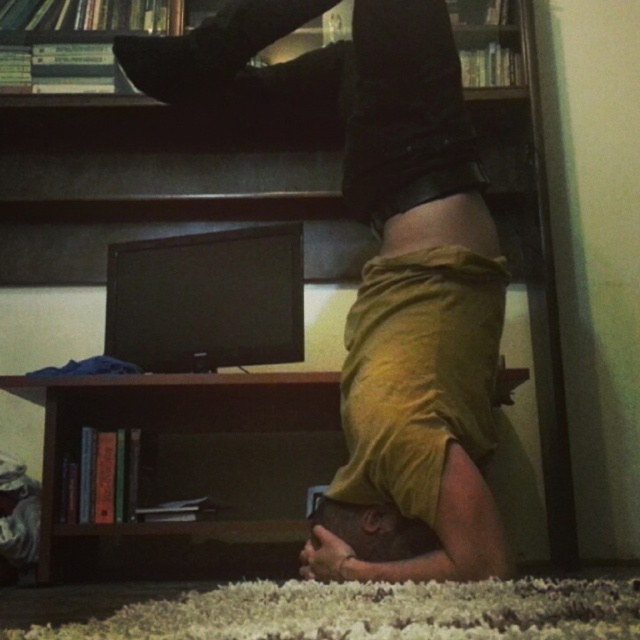
Question: Is brown wood bookshelf at lower center positioned behind matte black monitor at center?

Choices:
 (A) no
 (B) yes

Answer: (A)

Question: Which point is closer to the camera taking this photo?

Choices:
 (A) (109, 333)
 (B) (371, 531)
 (C) (234, 554)
 (D) (369, 493)

Answer: (B)

Question: Can you confirm if mustard yellow fabric at center is positioned to the left of black matte shoe at upper center?

Choices:
 (A) no
 (B) yes

Answer: (A)

Question: Can you confirm if brown wood bookshelf at lower center is thinner than brown matte head at lower center?

Choices:
 (A) yes
 (B) no

Answer: (B)

Question: Which of the following is the farthest from the observer?

Choices:
 (A) (196, 88)
 (B) (228, 428)
 (C) (424, 563)

Answer: (B)

Question: Estimate the real-world distances between objects in this image. Which object is farther from the mustard yellow fabric at center?

Choices:
 (A) black matte shoe at upper center
 (B) matte black monitor at center

Answer: (B)